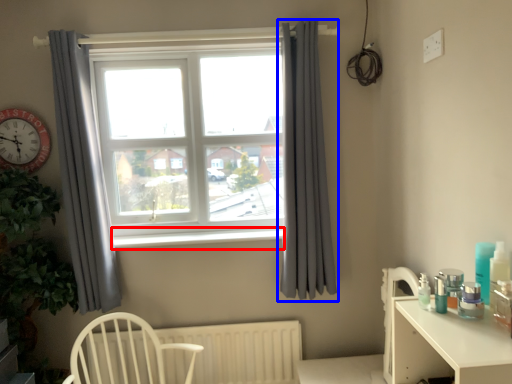
Question: Which object is further to the camera taking this photo, window sill (highlighted by a red box) or curtain (highlighted by a blue box)?

Choices:
 (A) window sill
 (B) curtain

Answer: (A)